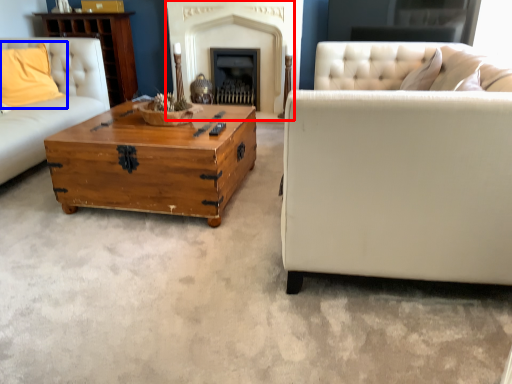
Question: Which object is further to the camera taking this photo, fireplace (highlighted by a red box) or pillow (highlighted by a blue box)?

Choices:
 (A) fireplace
 (B) pillow

Answer: (A)